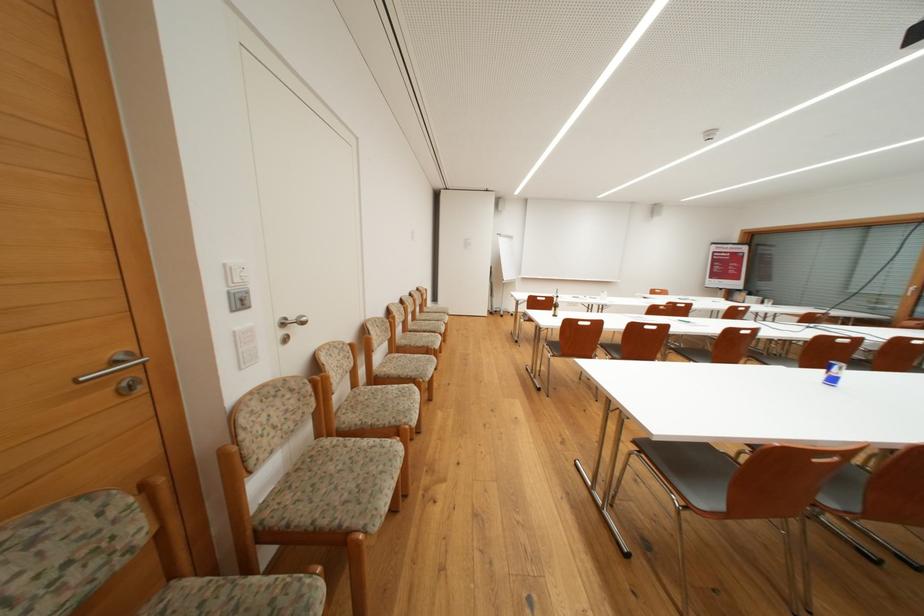
You are a GUI agent. You are given a task and a screenshot of the screen. Output one action in this format:
    pyautogui.click(x=<x>, y=<y>)
    Task: Click on the white control panel
    Image resolution: width=924 pixels, height=616 pixels.
    Given the screenshot: What is the action you would take?
    pyautogui.click(x=246, y=345)